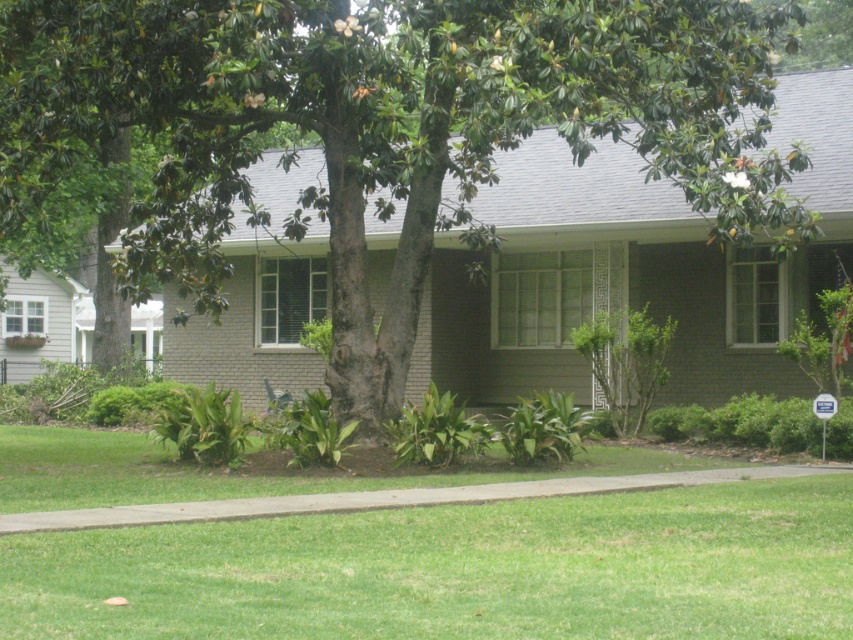
Question: Does green leafy tree at center appear on the left side of green grass at lower center?

Choices:
 (A) no
 (B) yes

Answer: (A)

Question: Does green leafy tree at center have a lesser width compared to green grass at lower center?

Choices:
 (A) yes
 (B) no

Answer: (B)

Question: Among these objects, which one is nearest to the camera?

Choices:
 (A) green leafy tree at center
 (B) green grass at lower center

Answer: (B)

Question: Among these objects, which one is farthest from the camera?

Choices:
 (A) green leafy tree at center
 (B) green grass at lower center

Answer: (A)

Question: Does green leafy tree at center have a larger size compared to green grass at lower center?

Choices:
 (A) no
 (B) yes

Answer: (B)